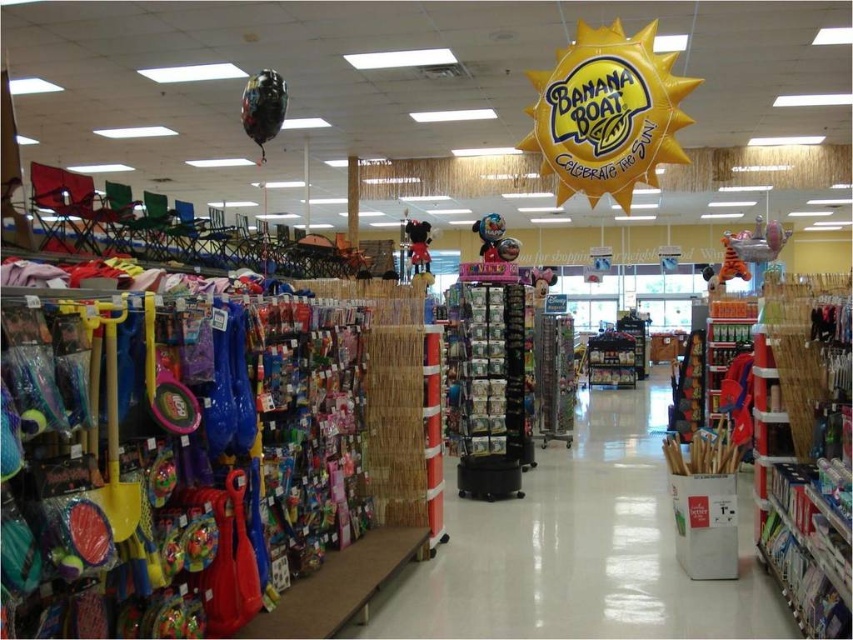
Who is shorter, plush red mickey mouse at center or matte pink plush toy at center?

With less height is plush red mickey mouse at center.

Which is more to the right, plush red mickey mouse at center or matte pink plush toy at center?

matte pink plush toy at center is more to the right.

In order to click on plush red mickey mouse at center in this screenshot , I will do `click(418, 244)`.

Locate an element on the screen. The image size is (853, 640). plush red mickey mouse at center is located at coordinates (418, 244).

Is wooden sticks at center bigger than plush red mickey mouse at center?

Correct, wooden sticks at center is larger in size than plush red mickey mouse at center.

In the scene shown: Between wooden sticks at center and plush red mickey mouse at center, which one appears on the left side from the viewer's perspective?

plush red mickey mouse at center

Does point (730, 624) come behind point (421, 256)?

That is False.

Locate an element on the screen. The height and width of the screenshot is (640, 853). wooden sticks at center is located at coordinates (579, 548).

Does shiny metallic helmet at center have a greater height compared to matte pink plush toy at center?

In fact, shiny metallic helmet at center may be shorter than matte pink plush toy at center.

The image size is (853, 640). Describe the element at coordinates (489, 234) in the screenshot. I see `shiny metallic helmet at center` at that location.

This screenshot has width=853, height=640. I want to click on shiny metallic helmet at center, so click(x=489, y=234).